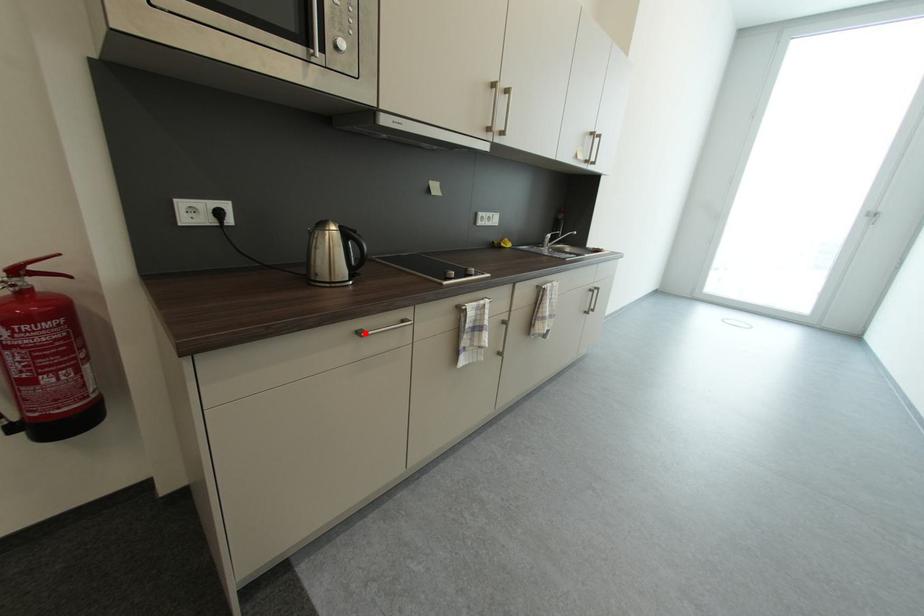
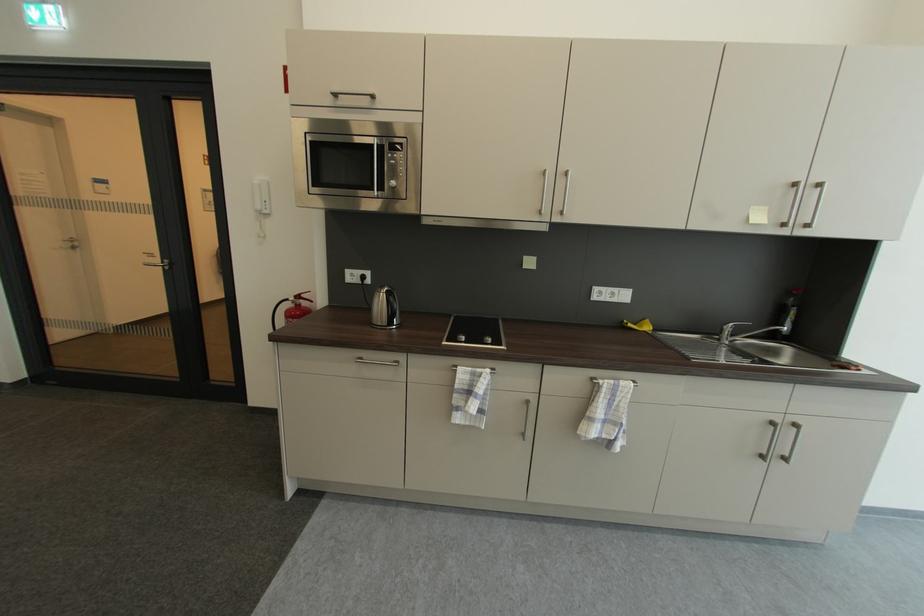
Find the pixel in the second image that matches the highlighted location in the first image.

(367, 360)